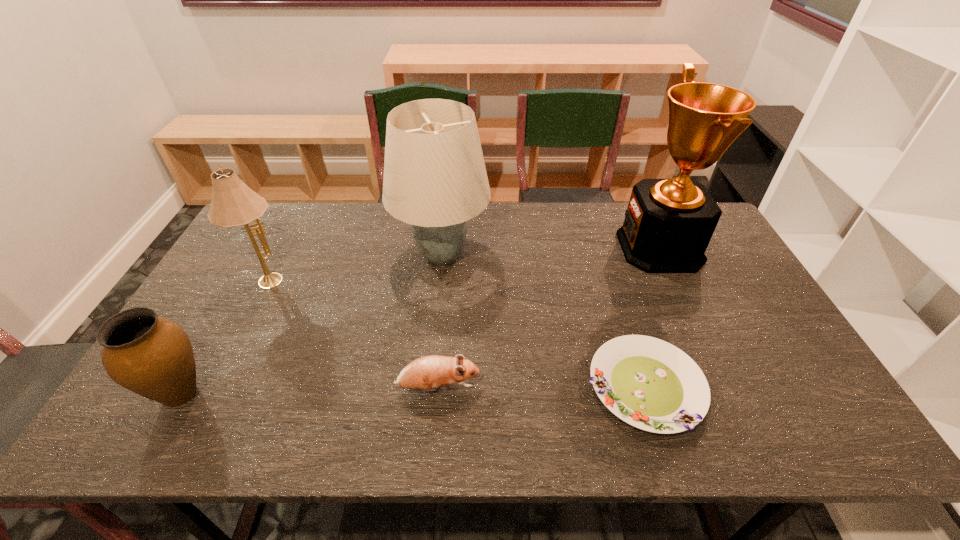
Where is `trophy cup`? The image size is (960, 540). trophy cup is located at coordinates (668, 224).

Find the location of `the right lampshade`. the right lampshade is located at coordinates (435, 179).

The image size is (960, 540). Find the location of `the shorter lampshade`. the shorter lampshade is located at coordinates (233, 203).

Where is `the fourth shortest object`? This screenshot has height=540, width=960. the fourth shortest object is located at coordinates (233, 203).

Where is `the third shortest object`? the third shortest object is located at coordinates (151, 356).

Identify the location of hamster. The image size is (960, 540). (427, 373).

Image resolution: width=960 pixels, height=540 pixels. I want to click on salad plate, so click(648, 383).

The image size is (960, 540). Identify the location of vacant space positioned on the front of the trophy cup with the label. (560, 248).

In order to click on free space located 0.280m on the front of the trophy cup with the label in this screenshot , I will do `click(536, 248)`.

At what (x,y) coordinates should I click in order to perform the action: click on free spot located on the front of the trophy cup with the label. Please return your answer as a coordinate pair (x, y). The width and height of the screenshot is (960, 540). Looking at the image, I should click on (551, 248).